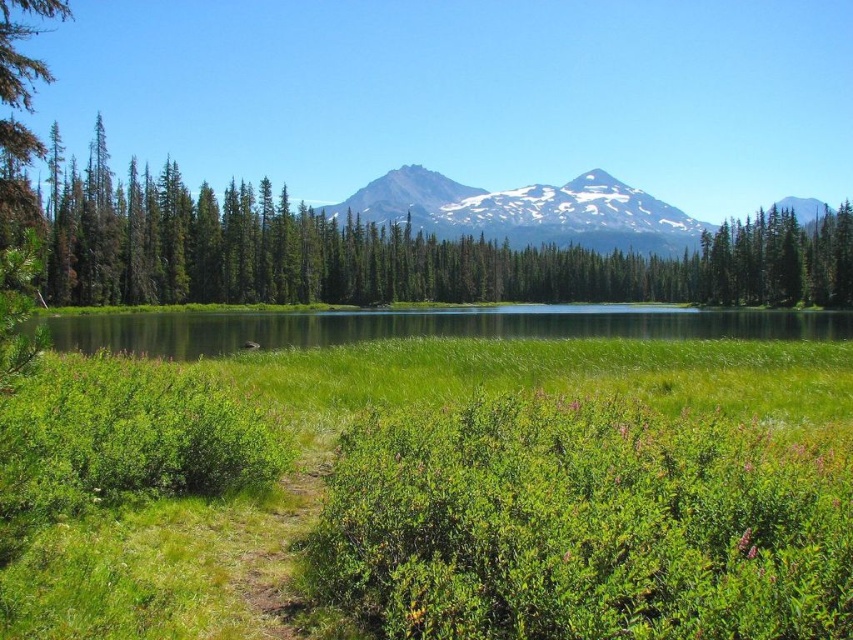
Which is behind, point (757, 461) or point (630, 204)?

The point (630, 204) is more distant.

Which of these two, green leafy grass at lower center or snowy rock mountain at center, stands shorter?

green leafy grass at lower center is shorter.

Is point (343, 529) more distant than point (788, 202)?

No, it is in front of (788, 202).

The image size is (853, 640). What are the coordinates of `green leafy grass at lower center` in the screenshot? It's located at (534, 474).

Does green leafy trees at center appear over snowy rock mountain at center?

Incorrect, green leafy trees at center is not positioned above snowy rock mountain at center.

Is green leafy trees at center taller than snowy rock mountain at center?

No.

Which is in front, point (247, 236) or point (549, 234)?

Positioned in front is point (247, 236).

Find the location of a particular element. Image resolution: width=853 pixels, height=640 pixels. green leafy trees at center is located at coordinates (380, 252).

Measure the distance between green leafy trees at center and camera.

green leafy trees at center and camera are 30.07 feet apart.

Who is positioned more to the right, green leafy trees at center or green grassy water at center?

Positioned to the right is green leafy trees at center.

This screenshot has height=640, width=853. What do you see at coordinates (380, 252) in the screenshot?
I see `green leafy trees at center` at bounding box center [380, 252].

At what (x,y) coordinates should I click in order to perform the action: click on green leafy trees at center. Please return your answer as a coordinate pair (x, y). The width and height of the screenshot is (853, 640). Looking at the image, I should click on (380, 252).